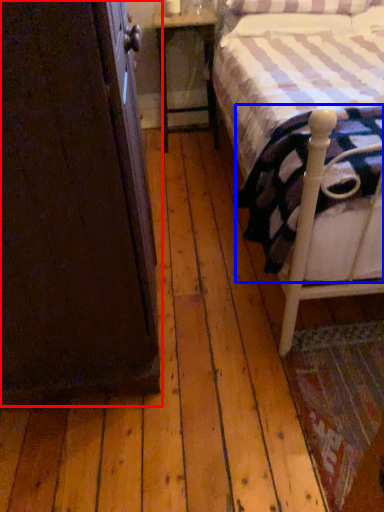
Question: Which object appears closest to the camera in this image, armoire (highlighted by a red box) or mattress (highlighted by a blue box)?

Choices:
 (A) armoire
 (B) mattress

Answer: (A)